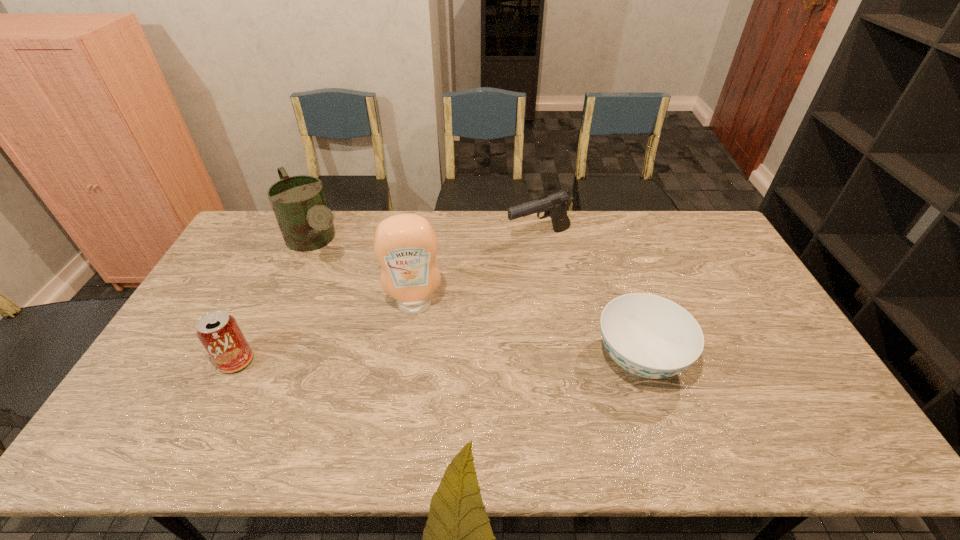
This screenshot has height=540, width=960. Identify the location of soda can. (219, 333).

Where is `the shortest object`? The image size is (960, 540). the shortest object is located at coordinates [650, 336].

Find the location of a particular element. watering can is located at coordinates (299, 203).

The image size is (960, 540). What are the coordinates of `gun` in the screenshot? It's located at [x=554, y=206].

Where is `the third farthest object`? the third farthest object is located at coordinates (405, 245).

The image size is (960, 540). What are the coordinates of `condiment` in the screenshot? It's located at (405, 245).

Where is `vacant space situated on the right of the soda can`? vacant space situated on the right of the soda can is located at coordinates (330, 361).

Locate an element on the screen. free space located 0.170m on the right of the chinaware is located at coordinates (748, 359).

Where is `free point located with the spout on the fourth shortest object`? free point located with the spout on the fourth shortest object is located at coordinates (378, 341).

Image resolution: width=960 pixels, height=540 pixels. Find the location of `vacant region located 0.110m with the spout on the fourth shortest object`. vacant region located 0.110m with the spout on the fourth shortest object is located at coordinates (343, 291).